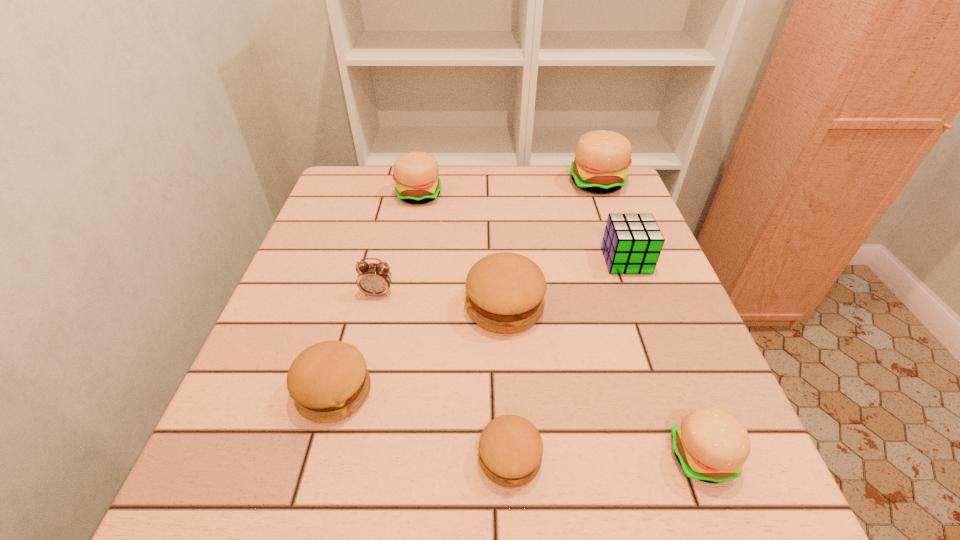
Point out which hamburger is positioned as the fourth nearest to the tallest object. Please provide its 2D coordinates. Your answer should be formatted as a tuple, i.e. [(x, y)], where the tuple contains the x and y coordinates of a point satisfying the conditions above.

[(510, 450)]

What are the coordinates of `beige hamburger that is the third closest one to the cube` in the screenshot? It's located at (415, 174).

Locate an element on the screen. the second closest beige hamburger to the alarm clock is located at coordinates (711, 445).

The height and width of the screenshot is (540, 960). What are the coordinates of `the closest brown hamburger to the biggest beige hamburger` in the screenshot? It's located at (505, 291).

At what (x,y) coordinates should I click in order to perform the action: click on brown hamburger that is the third closest one to the second biggest beige hamburger. Please return your answer as a coordinate pair (x, y). Looking at the image, I should click on (510, 450).

You are a GUI agent. You are given a task and a screenshot of the screen. Output one action in this format:
    pyautogui.click(x=<x>, y=<y>)
    Task: Click on the vacant space that satisfies the following two spatial constraints: 1. on the back side of the third nearest hamburger; 2. on the left side of the cube
    The image size is (960, 540).
    Given the screenshot: What is the action you would take?
    pyautogui.click(x=371, y=260)